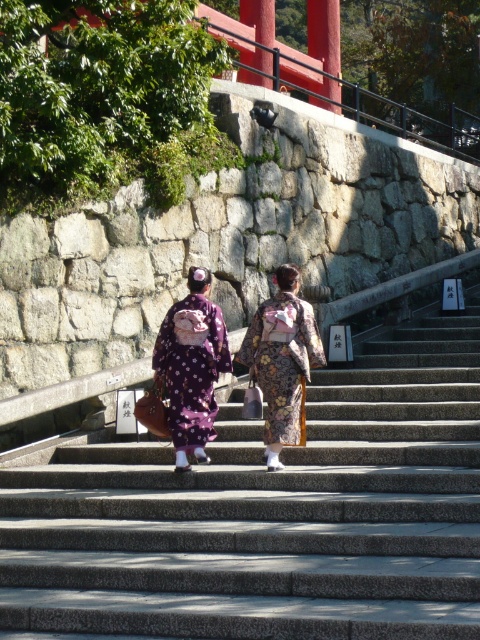
You are standing at the bottom of the smooth stone stairs at center. What are the coordinates of the stairs where you are standing?

The coordinates of the smooth stone stairs at center are at point (268, 516).

You are standing at the bottom of the smooth stone stairs at center and want to reach the purple satin kimono at center. Which direction should you move?

The smooth stone stairs at center is to the right of the purple satin kimono at center, so you should move to your left to reach it.

You are a photographer planning to take a picture of the purple satin kimono at center and the floral kimono at center. Since you want both kimonos to appear equally prominent in the photo, which kimono should you zoom in more on and why?

The purple satin kimono at center is smaller in size compared to the floral kimono at center. To make both appear equally prominent, you should zoom in more on the purple satin kimono at center to compensate for its smaller size.